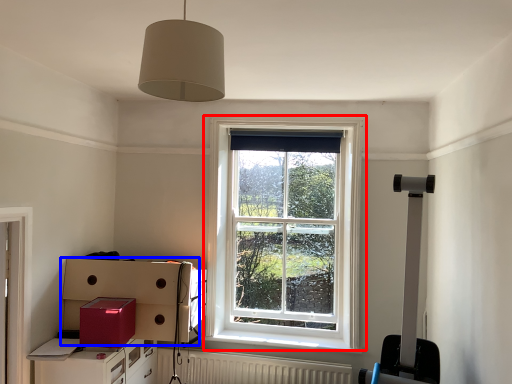
Question: Which object appears closest to the camera in this image, window (highlighted by a red box) or cardboard box (highlighted by a blue box)?

Choices:
 (A) window
 (B) cardboard box

Answer: (B)